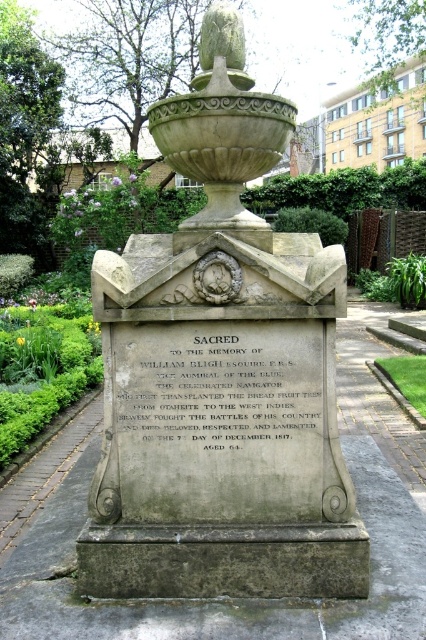
Question: Among these points, which one is nearest to the camera?

Choices:
 (A) (342, 250)
 (B) (233, 396)

Answer: (B)

Question: Is gray stone monument at center to the right of gray stone plaque at center from the viewer's perspective?

Choices:
 (A) no
 (B) yes

Answer: (B)

Question: Which object is closer to the camera taking this photo?

Choices:
 (A) gray stone monument at center
 (B) gray stone plaque at center

Answer: (A)

Question: Is gray stone monument at center wider than gray stone plaque at center?

Choices:
 (A) yes
 (B) no

Answer: (A)

Question: Which object appears farthest from the camera in this image?

Choices:
 (A) gray stone plaque at center
 (B) gray stone monument at center

Answer: (A)

Question: Can you confirm if gray stone monument at center is thinner than gray stone plaque at center?

Choices:
 (A) yes
 (B) no

Answer: (B)